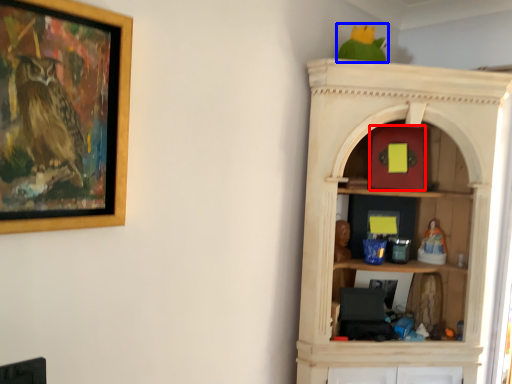
Question: Which object is closer to the camera taking this photo, toy (highlighted by a red box) or parrot (highlighted by a blue box)?

Choices:
 (A) toy
 (B) parrot

Answer: (B)